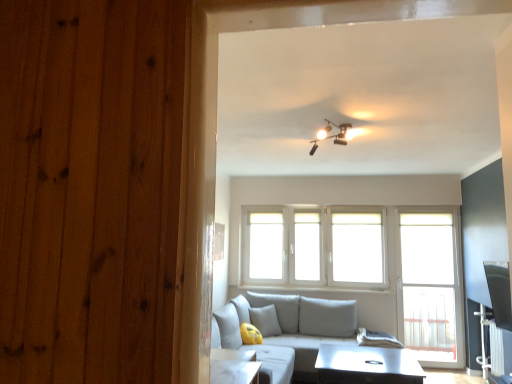
Find the location of a particular element. The image size is (512, 384). vacant space situated above white glossy bay window at center (from a real-world perspective) is located at coordinates (316, 205).